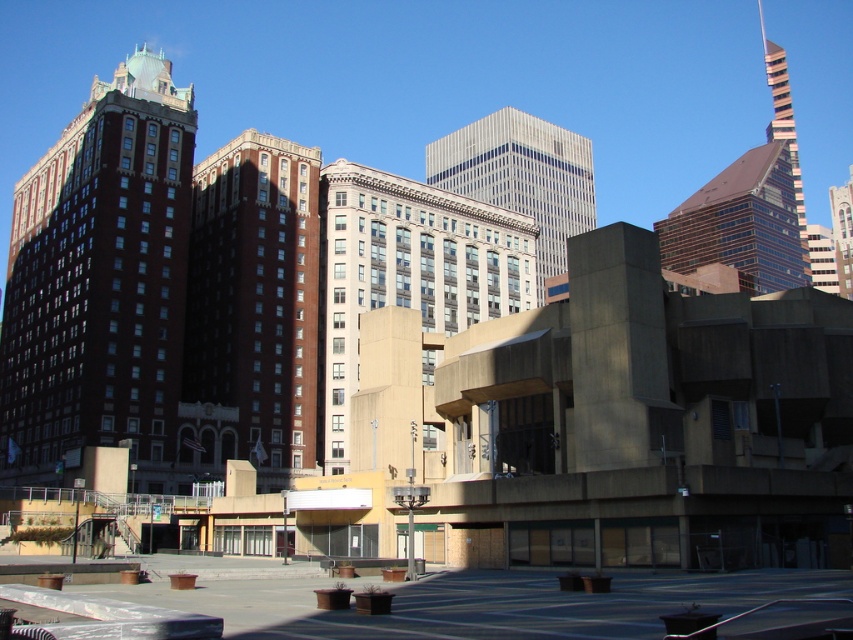
You are standing in the city and want to take a photo of the brown brick building at center. If your camera has a maximum focus range of 250 feet, will it be able to capture the building clearly?

The brown brick building at center is 249.90 feet away from the viewer, which is within the camera maximum focus range of 250 feet. Therefore, the camera can capture the building clearly.

You are an urban planner assessing the city layout. You need to determine if the brown brick building at center can be expanded eastward without encroaching on the white glass building at center. Given their current widths, what do you recommend?

The brown brick building at center is narrower than the white glass building at center. Since the brown brick building at center has less width, there might be sufficient space to expand eastward without immediately encroaching on the white glass building at center, but further spatial analysis would be needed to confirm exact boundaries.

You are standing at the point with coordinates point [367,253] and want to see the point with coordinates point [219,323]. Is there any obstruction between you and that point?

Point [219,323] is in front of point [367,253], so there is no obstruction between them.